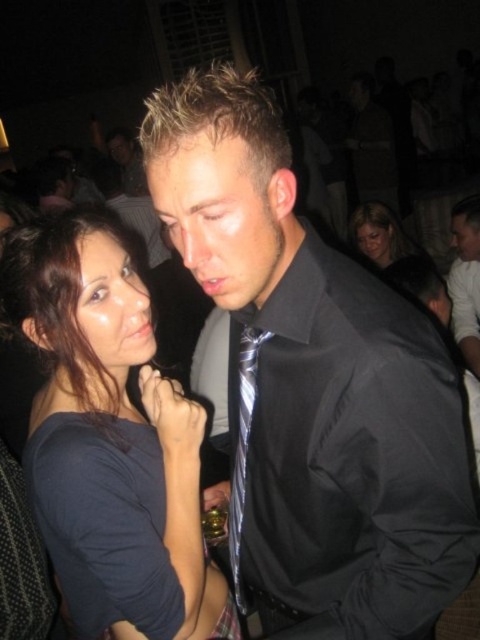
Can you confirm if silver metallic tie at center is bigger than matte black hair at upper center?

Actually, silver metallic tie at center might be smaller than matte black hair at upper center.

Measure the distance between point (x=235, y=596) and camera.

Point (x=235, y=596) and camera are 4.33 feet apart.

Locate an element on the screen. The height and width of the screenshot is (640, 480). silver metallic tie at center is located at coordinates (242, 449).

Between black satin shirt at center and matte black hair at upper center, which one has less height?

matte black hair at upper center

Who is more distant from viewer, (384, 596) or (397, 244)?

Positioned behind is point (397, 244).

At what (x,y) coordinates should I click in order to perform the action: click on black satin shirt at center. Please return your answer as a coordinate pair (x, y). Looking at the image, I should click on (313, 380).

Who is shorter, black satin shirt at center or silver metallic tie at center?

With less height is silver metallic tie at center.

The width and height of the screenshot is (480, 640). Find the location of `black satin shirt at center`. black satin shirt at center is located at coordinates (313, 380).

The image size is (480, 640). I want to click on black satin shirt at center, so click(x=313, y=380).